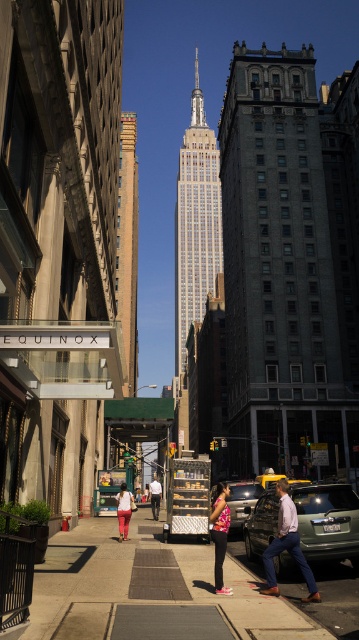
Question: Which object appears farthest from the camera in this image?

Choices:
 (A) brick textured building at center
 (B) green matte car at center
 (C) metallic silver taxi at center
 (D) pink floral shirt at center

Answer: (A)

Question: Does dark gray stone building at center appear under metallic silver taxi at center?

Choices:
 (A) no
 (B) yes

Answer: (A)

Question: Is concrete sidewalk at center closer to camera compared to white shirt at center?

Choices:
 (A) yes
 (B) no

Answer: (A)

Question: Is concrete sidewalk at center wider than matte pink pants at center?

Choices:
 (A) yes
 (B) no

Answer: (A)

Question: Which point is closer to the camera?

Choices:
 (A) brick textured building at center
 (B) pink floral shirt at center
 (C) metallic silver taxi at center
 (D) blue jeans at center

Answer: (B)

Question: Which point appears closest to the camera in this image?

Choices:
 (A) (229, 490)
 (B) (212, 268)
 (C) (126, 358)

Answer: (A)